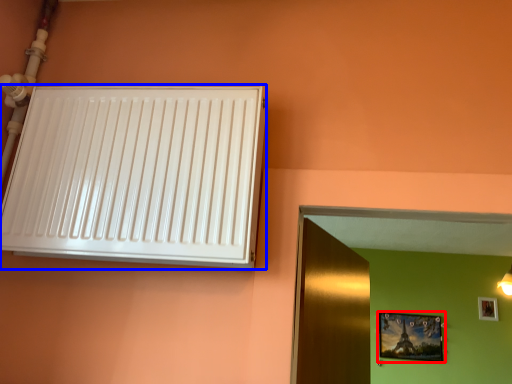
Question: Which point is closer to the camera, picture frame (highlighted by a red box) or air conditioning (highlighted by a blue box)?

Choices:
 (A) picture frame
 (B) air conditioning

Answer: (B)